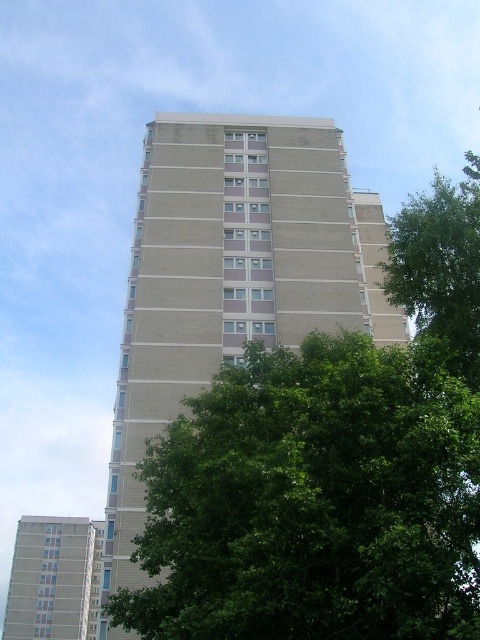
Question: Estimate the real-world distances between objects in this image. Which object is farther from the beige concrete building at lower left?

Choices:
 (A) green leafy tree at right
 (B) beige brick building at center

Answer: (B)

Question: Is beige brick building at center above green leafy tree at right?

Choices:
 (A) yes
 (B) no

Answer: (B)

Question: Which object is closer to the camera taking this photo?

Choices:
 (A) beige brick building at center
 (B) green leafy tree at right
 (C) beige concrete building at lower left

Answer: (B)

Question: Based on their relative distances, which object is farther from the beige brick building at center?

Choices:
 (A) beige concrete building at lower left
 (B) green leafy tree at right

Answer: (A)

Question: Can you confirm if beige brick building at center is wider than beige concrete building at lower left?

Choices:
 (A) no
 (B) yes

Answer: (A)

Question: Does green leafy tree at right have a smaller size compared to beige concrete building at lower left?

Choices:
 (A) no
 (B) yes

Answer: (A)